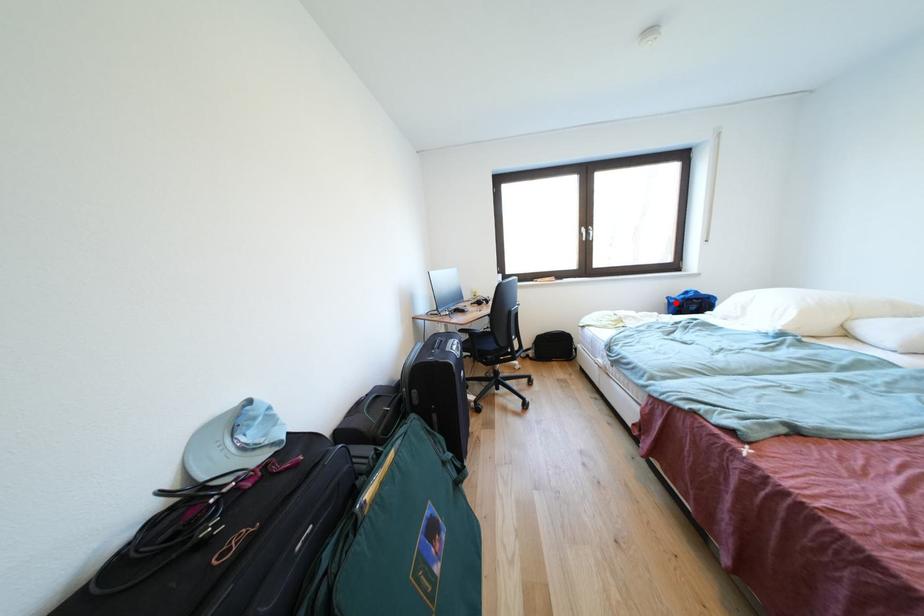
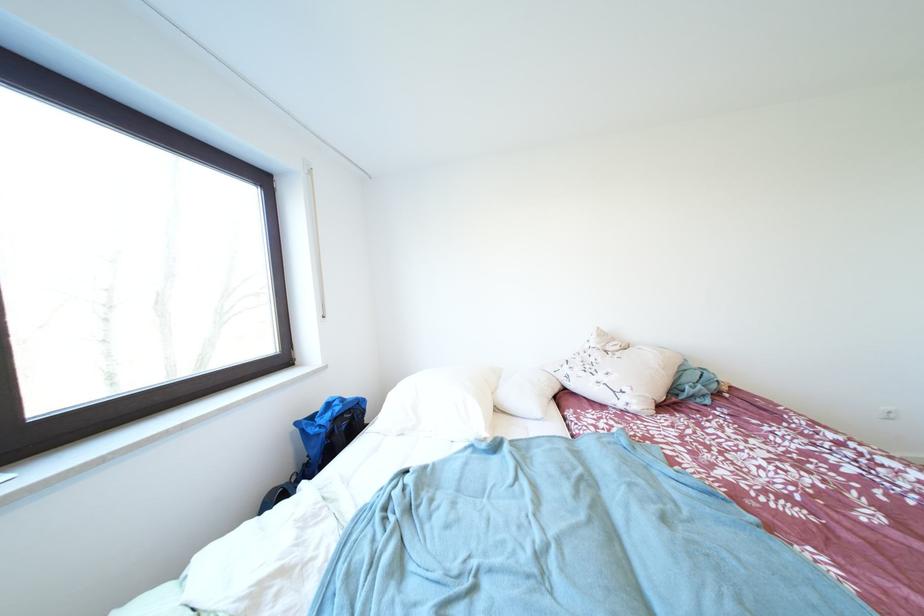
Question: I am providing you with two images of the same scene from different viewpoints. Image1 has a red point marked. In image2, the corresponding 3D location appears at what relative position? Reply with the corresponding letter.

Choices:
 (A) Closer
 (B) Farther

Answer: (B)